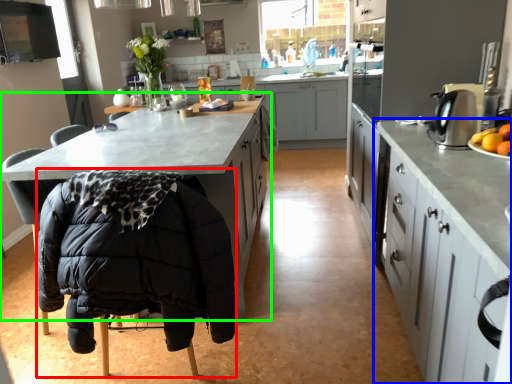
Question: Which object is positioned farthest from folding chair (highlighted by a red box)? Select from cabinetry (highlighted by a blue box) and cabinetry (highlighted by a green box).

Choices:
 (A) cabinetry
 (B) cabinetry

Answer: (A)